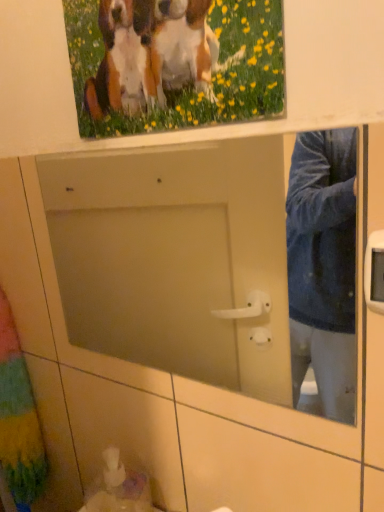
Question: Considering the relative sizes of white glossy sink at lower left and multicolored fabric curtain at left in the image provided, is white glossy sink at lower left wider than multicolored fabric curtain at left?

Choices:
 (A) yes
 (B) no

Answer: (B)

Question: Is white glossy sink at lower left oriented towards multicolored fabric curtain at left?

Choices:
 (A) no
 (B) yes

Answer: (A)

Question: From a real-world perspective, is white glossy sink at lower left under multicolored fabric curtain at left?

Choices:
 (A) yes
 (B) no

Answer: (A)

Question: From the image's perspective, is white glossy sink at lower left located above multicolored fabric curtain at left?

Choices:
 (A) yes
 (B) no

Answer: (B)

Question: Is white glossy sink at lower left next to multicolored fabric curtain at left and touching it?

Choices:
 (A) yes
 (B) no

Answer: (B)

Question: Is multicolored fabric curtain at left wider or thinner than wooden picture frame at upper center?

Choices:
 (A) thin
 (B) wide

Answer: (B)

Question: Is multicolored fabric curtain at left inside or outside of wooden picture frame at upper center?

Choices:
 (A) outside
 (B) inside

Answer: (A)

Question: From the image's perspective, is multicolored fabric curtain at left above or below wooden picture frame at upper center?

Choices:
 (A) below
 (B) above

Answer: (A)

Question: Considering their positions, is multicolored fabric curtain at left located in front of or behind wooden picture frame at upper center?

Choices:
 (A) behind
 (B) front

Answer: (A)

Question: Based on their sizes in the image, would you say wooden picture frame at upper center is bigger or smaller than white glossy sink at lower left?

Choices:
 (A) big
 (B) small

Answer: (A)

Question: Is wooden picture frame at upper center inside or outside of white glossy sink at lower left?

Choices:
 (A) outside
 (B) inside

Answer: (A)

Question: In the image, is wooden picture frame at upper center on the left side or the right side of white glossy sink at lower left?

Choices:
 (A) right
 (B) left

Answer: (A)

Question: Does point (102, 25) appear closer or farther from the camera than point (122, 484)?

Choices:
 (A) farther
 (B) closer

Answer: (B)

Question: In terms of size, does white glossy sink at lower left appear bigger or smaller than multicolored fabric curtain at left?

Choices:
 (A) small
 (B) big

Answer: (A)

Question: In terms of width, does white glossy sink at lower left look wider or thinner when compared to multicolored fabric curtain at left?

Choices:
 (A) thin
 (B) wide

Answer: (A)